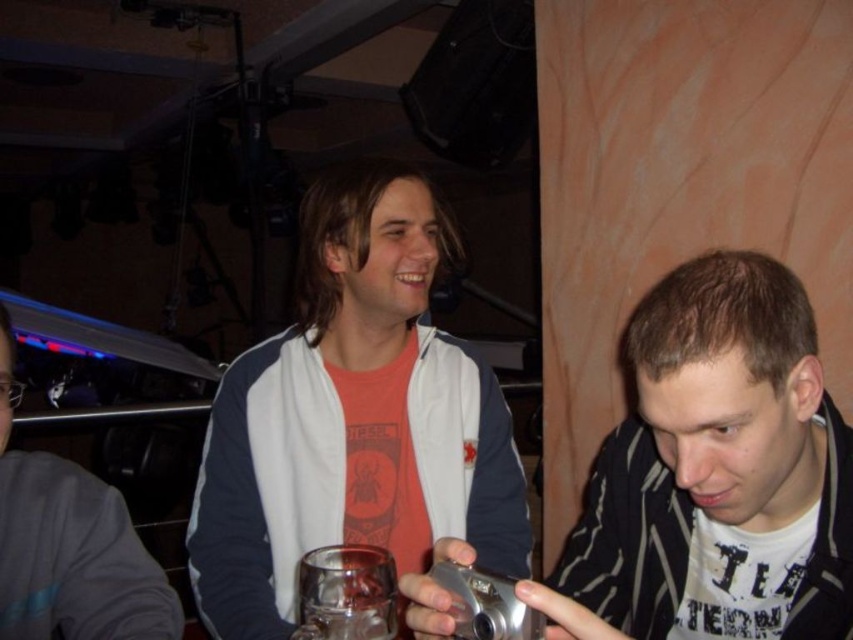
Question: Where is brushed metal camera at center located in relation to translucent glass at center in the image?

Choices:
 (A) below
 (B) above

Answer: (A)

Question: Which object is closer to the camera taking this photo?

Choices:
 (A) brushed metal camera at center
 (B) white matte jacket at center

Answer: (A)

Question: Which point is farther from the camera taking this photo?

Choices:
 (A) (88, 625)
 (B) (668, 560)
 (C) (370, 340)

Answer: (C)

Question: Does brushed metal camera at center have a larger size compared to translucent glass at center?

Choices:
 (A) no
 (B) yes

Answer: (B)

Question: Which of the following is the farthest from the observer?

Choices:
 (A) (36, 637)
 (B) (360, 564)

Answer: (A)

Question: Does white matte jacket at center appear under white matte shirt at lower right?

Choices:
 (A) yes
 (B) no

Answer: (B)